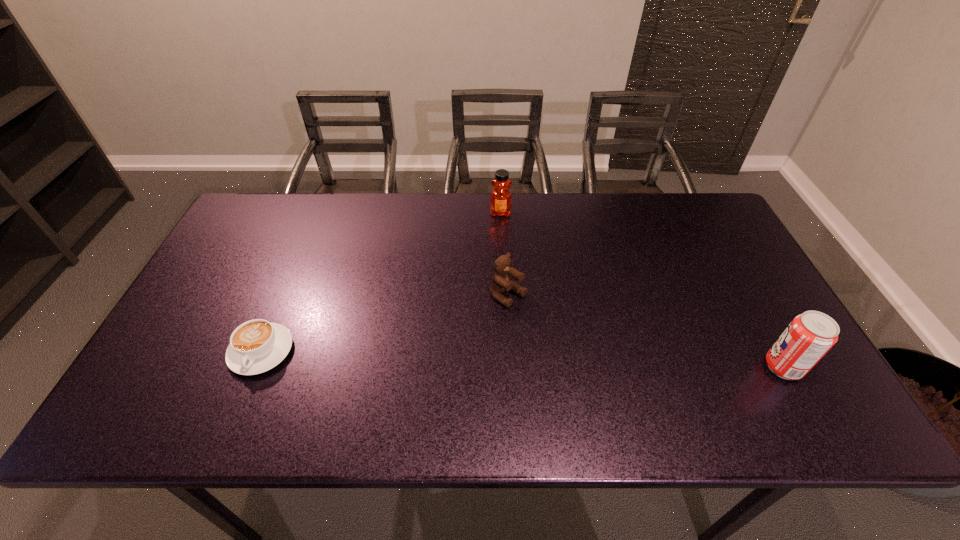
Locate an element on the screen. The image size is (960, 540). free space at the right edge of the desktop is located at coordinates (755, 298).

At what (x,y) coordinates should I click in order to perform the action: click on blank space at the far left corner. Please return your answer as a coordinate pair (x, y). Image resolution: width=960 pixels, height=540 pixels. Looking at the image, I should click on (262, 193).

Find the location of a particular element. The height and width of the screenshot is (540, 960). free space between the farthest object and the rightmost object is located at coordinates (641, 290).

Where is `free point between the cappuccino and the farthest object`? This screenshot has width=960, height=540. free point between the cappuccino and the farthest object is located at coordinates (381, 282).

This screenshot has width=960, height=540. Identify the location of vacant area that lies between the soda can and the shortest object. (522, 359).

Locate an element on the screen. The height and width of the screenshot is (540, 960). free space between the soda can and the teddy bear is located at coordinates (646, 332).

You are a GUI agent. You are given a task and a screenshot of the screen. Output one action in this format:
    pyautogui.click(x=<x>, y=<y>)
    Task: Click on the unoccupied area between the cappuccino and the honey
    
    Given the screenshot: What is the action you would take?
    pyautogui.click(x=381, y=282)

This screenshot has width=960, height=540. Identify the location of free point between the honey and the teddy bear. (504, 254).

At what (x,y) coordinates should I click in order to perform the action: click on free spot between the honey and the rightmost object. Please return your answer as a coordinate pair (x, y). The height and width of the screenshot is (540, 960). Looking at the image, I should click on (641, 290).

Locate an element on the screen. free space that is in between the honey and the second shortest object is located at coordinates pos(504,254).